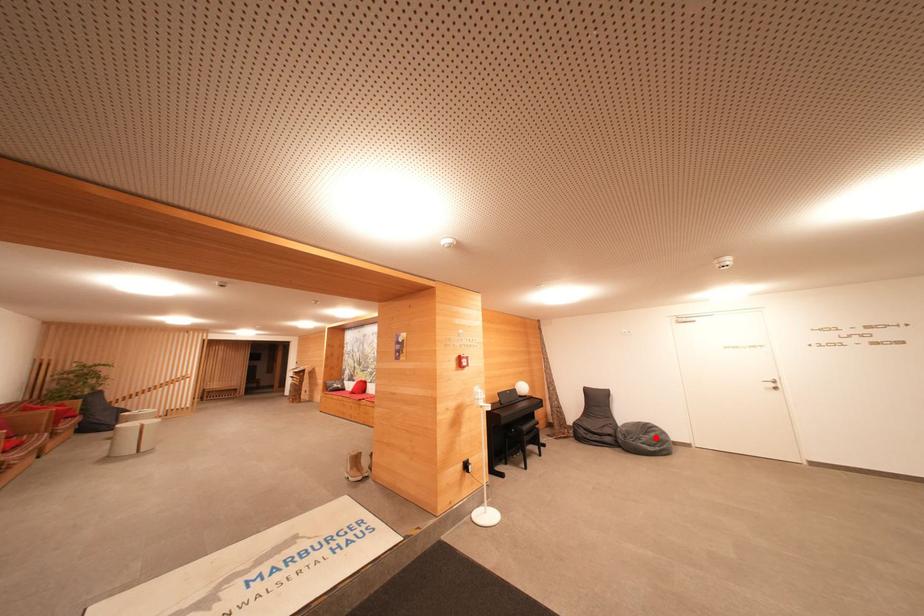
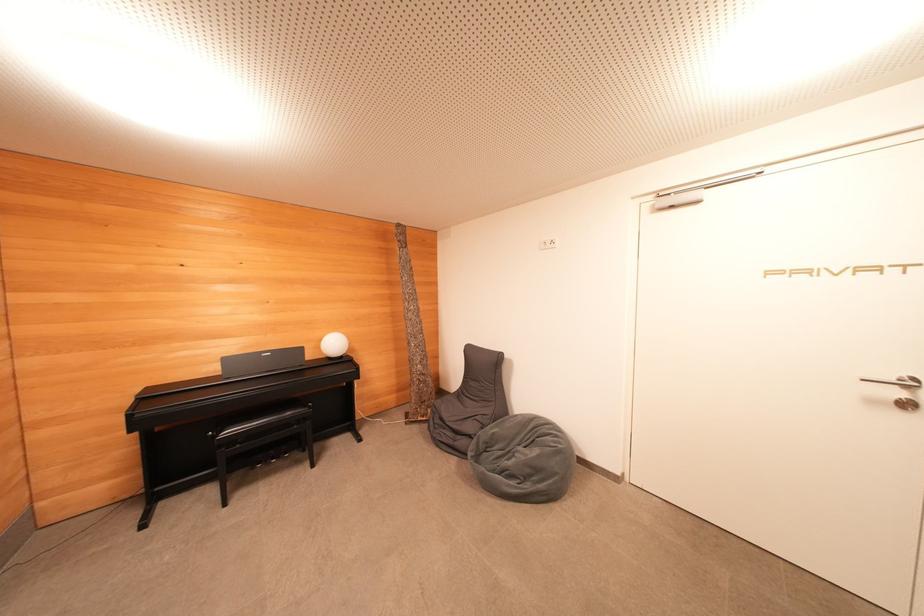
Question: I am providing you with two images of the same scene from different viewpoints. In image1, a red point is highlighted. Considering the same 3D point in image2, which of the following is correct?

Choices:
 (A) It is closer
 (B) It is farther

Answer: (A)